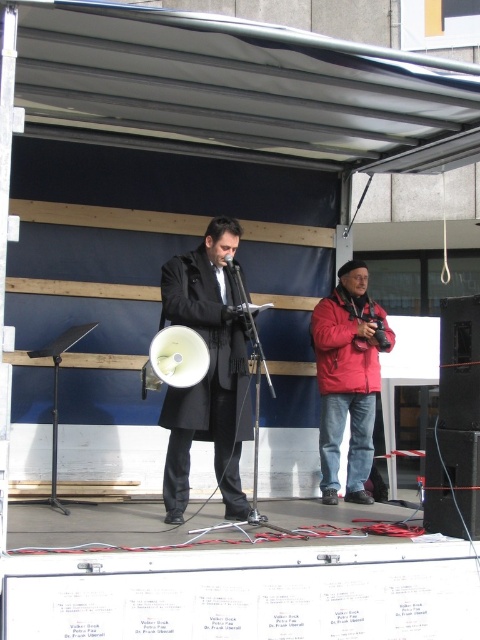
Who is higher up, matte black coat at center or black plastic speaker at center?

black plastic speaker at center is above.

Based on the photo, between matte black coat at center and black plastic speaker at center, which one has less height?

Standing shorter between the two is black plastic speaker at center.

Who is more distant from viewer, (167, 406) or (466, 401)?

Point (167, 406)

Image resolution: width=480 pixels, height=640 pixels. In order to click on matte black coat at center in this screenshot , I will do `click(207, 371)`.

Can you confirm if matte black coat at center is thinner than matte black megaphone at center?

No.

Which is behind, point (225, 216) or point (230, 266)?

The point (225, 216) is behind.

Locate an element on the screen. The height and width of the screenshot is (640, 480). matte black coat at center is located at coordinates (207, 371).

Between red matte jacket at right and black matte speaker at lower right, which one has more height?

With more height is red matte jacket at right.

Is red matte jacket at right taller than black matte speaker at lower right?

Indeed, red matte jacket at right has a greater height compared to black matte speaker at lower right.

What do you see at coordinates (348, 380) in the screenshot?
I see `red matte jacket at right` at bounding box center [348, 380].

This screenshot has width=480, height=640. I want to click on red matte jacket at right, so click(348, 380).